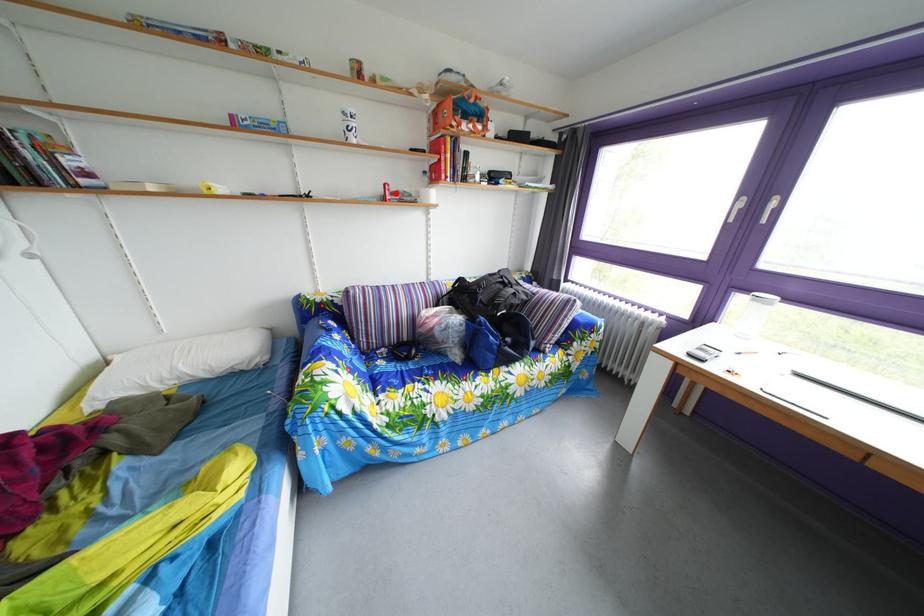
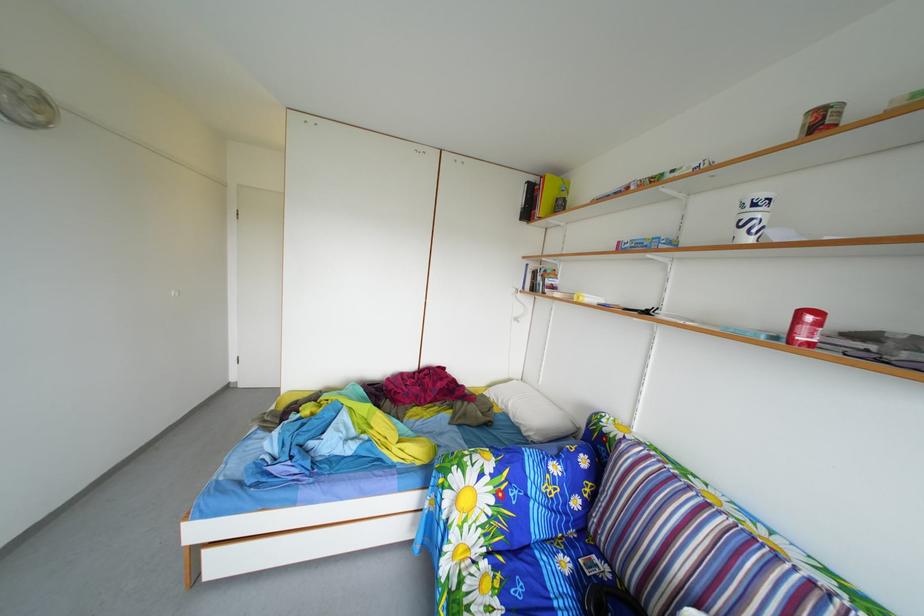
Question: I am providing you with two images of the same scene from different viewpoints. A red point is marked on the first image. At the location where the point appears in image 1, is it still visible in image 2?

Choices:
 (A) Yes
 (B) No

Answer: (A)